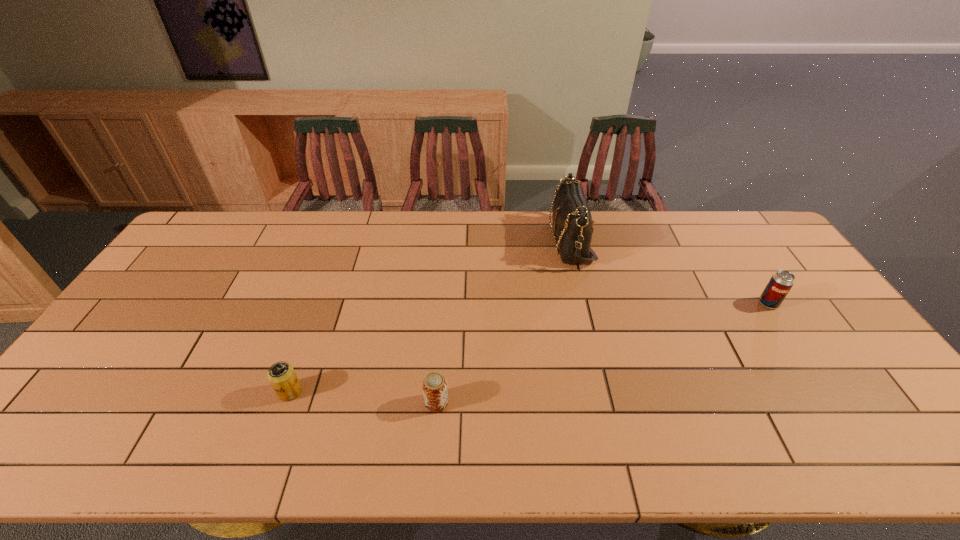
Identify the location of free space between the second farthest object and the handbag. (669, 272).

Where is `vacant region between the third object from right to left and the handbag`? This screenshot has width=960, height=540. vacant region between the third object from right to left and the handbag is located at coordinates (503, 322).

Find the location of a particular element. Image resolution: width=960 pixels, height=540 pixels. vacant region between the rightmost object and the leftmost object is located at coordinates (529, 348).

Find the location of `empty space between the handbag and the second beer can from right to left`. empty space between the handbag and the second beer can from right to left is located at coordinates (503, 322).

Where is `unoccupied area between the leftmost beer can and the third object from right to left`? Image resolution: width=960 pixels, height=540 pixels. unoccupied area between the leftmost beer can and the third object from right to left is located at coordinates (363, 397).

The width and height of the screenshot is (960, 540). I want to click on vacant space that is in between the farthest beer can and the leftmost object, so point(529,348).

Image resolution: width=960 pixels, height=540 pixels. In order to click on vacant area that lies between the rightmost beer can and the leftmost beer can in this screenshot , I will do `click(529, 348)`.

Identify the location of vacant space that is in between the leftmost beer can and the third nearest object. The image size is (960, 540). (529, 348).

Where is `vacant space that is in between the second object from left to right and the leftmost object`? This screenshot has height=540, width=960. vacant space that is in between the second object from left to right and the leftmost object is located at coordinates (363, 397).

Identify the location of blank region between the leftmost beer can and the third nearest object. (529, 348).